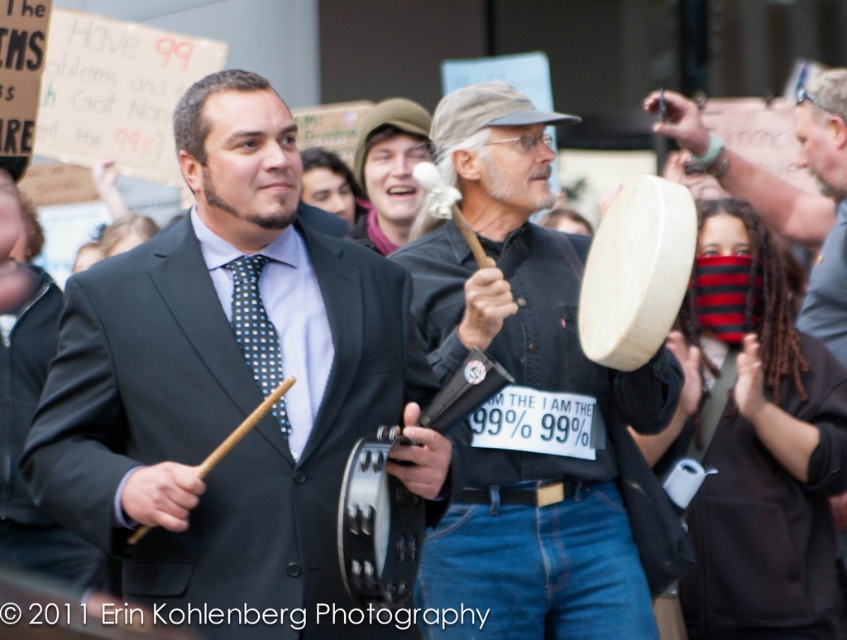
Which is more to the right, wooden tambourine at center or blue dotted fabric tie at center?

wooden tambourine at center is more to the right.

Is point (836, 193) positioned behind point (231, 304)?

Yes, point (836, 193) is behind point (231, 304).

Locate an element on the screen. The image size is (847, 640). wooden tambourine at center is located at coordinates (785, 189).

Does point (834, 273) come farther from viewer compared to point (367, 531)?

Yes, it is behind point (367, 531).

Is wooden tambourine at center to the right of black metallic tambourine at center from the viewer's perspective?

Correct, you'll find wooden tambourine at center to the right of black metallic tambourine at center.

You are a GUI agent. You are given a task and a screenshot of the screen. Output one action in this format:
    pyautogui.click(x=<x>, y=<y>)
    Task: Click on the wooden tambourine at center
    Image resolution: width=847 pixels, height=640 pixels.
    Given the screenshot: What is the action you would take?
    pyautogui.click(x=785, y=189)

Where is `wooden tambourine at center`? wooden tambourine at center is located at coordinates (785, 189).

Who is taller, black metallic tambourine at center or green fabric hat at center?

Standing taller between the two is green fabric hat at center.

Between black metallic tambourine at center and green fabric hat at center, which one has less height?

black metallic tambourine at center is shorter.

This screenshot has height=640, width=847. I want to click on black metallic tambourine at center, so click(377, 524).

This screenshot has height=640, width=847. In order to click on black metallic tambourine at center in this screenshot , I will do `click(377, 524)`.